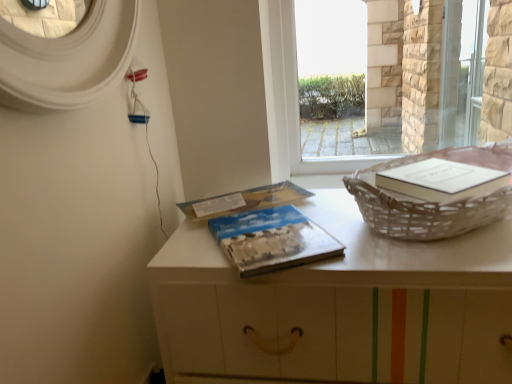
Locate an element on the screen. The image size is (512, 384). vacant space that's between blue textured paper at center, marked as the second paperback book in a back-to-front arrangement, and blue matte paper at center, the 1th paperback book when ordered from back to front is located at coordinates (291, 204).